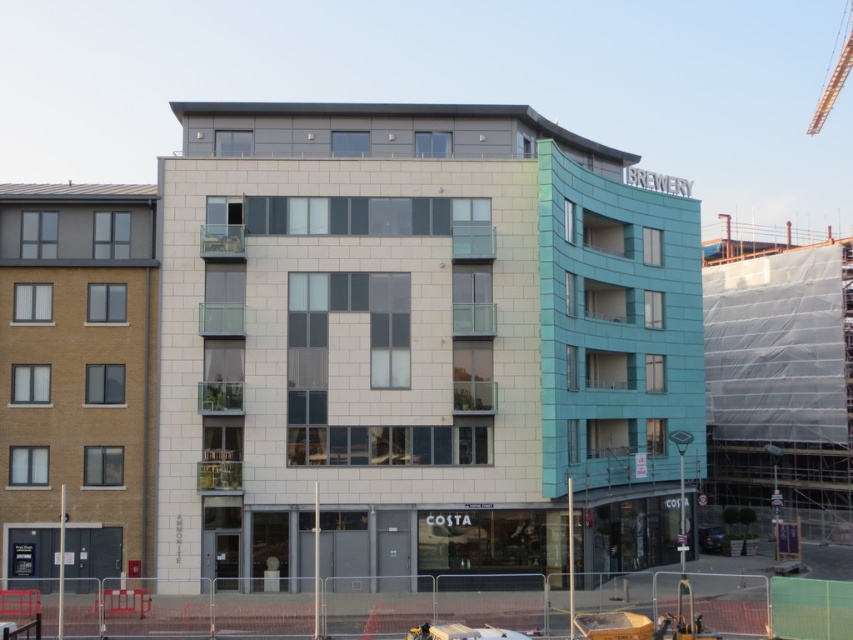
Does point (258, 195) lie in front of point (831, 108)?

Yes, it is in front of point (831, 108).

Is point (312, 125) farther from viewer compared to point (822, 122)?

That is False.

Locate an element on the screen. white textured building at center is located at coordinates coord(418,340).